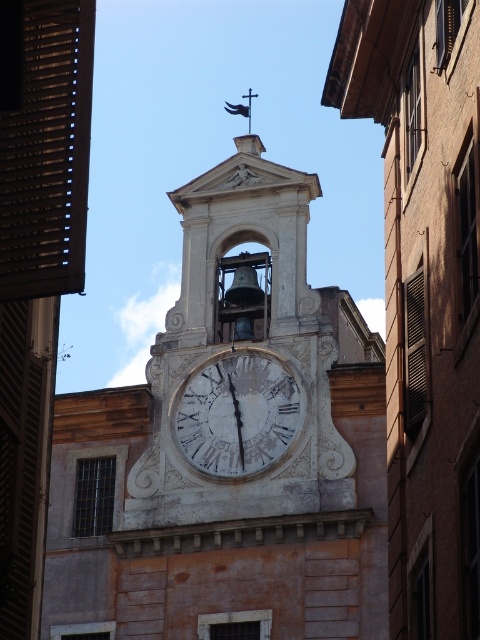
Question: Can you confirm if white stone clock at center is bigger than white marble clock at center?

Choices:
 (A) no
 (B) yes

Answer: (B)

Question: Among these objects, which one is farthest from the camera?

Choices:
 (A) white stone clock at center
 (B) white marble clock at center

Answer: (B)

Question: Observing the image, what is the correct spatial positioning of white stone clock at center in reference to white marble clock at center?

Choices:
 (A) right
 (B) left

Answer: (A)

Question: Can you confirm if white stone clock at center is positioned above white marble clock at center?

Choices:
 (A) yes
 (B) no

Answer: (B)